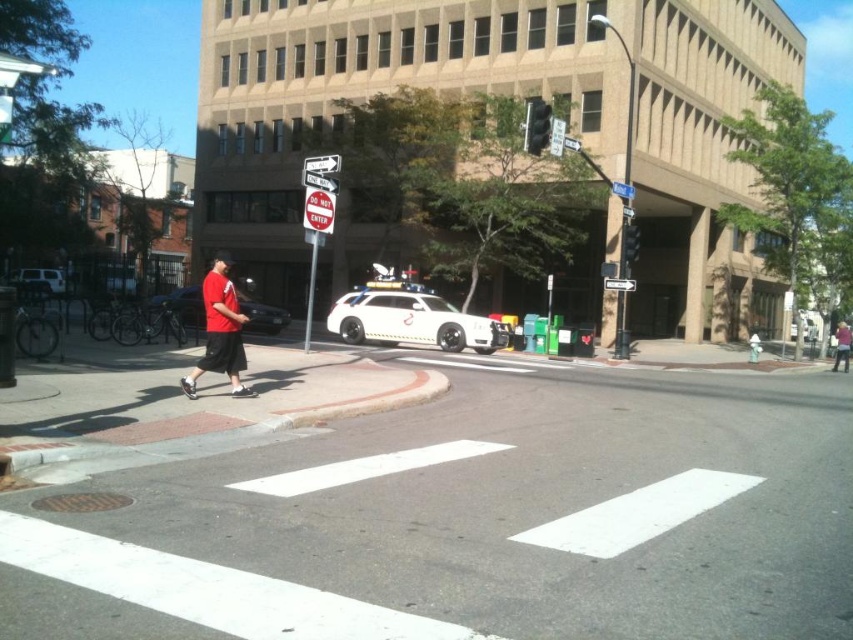
Question: Which point appears farthest from the camera in this image?

Choices:
 (A) (634, 257)
 (B) (276, 320)

Answer: (B)

Question: Is metallic traffic light at upper center positioned at the back of pink fabric shirt at center?

Choices:
 (A) no
 (B) yes

Answer: (A)

Question: Is white glossy suv at center to the left of white glossy car at left from the viewer's perspective?

Choices:
 (A) yes
 (B) no

Answer: (B)

Question: In this image, where is pink fabric shirt at center located relative to metallic traffic light at upper right?

Choices:
 (A) left
 (B) right

Answer: (B)

Question: Based on their relative distances, which object is farther from the red matte shirt at left?

Choices:
 (A) metallic traffic light at upper right
 (B) matte red shirt at center

Answer: (A)

Question: Which is farther from the metallic traffic light at upper center?

Choices:
 (A) pink fabric shirt at center
 (B) white glossy suv at center
 (C) red matte shirt at left
 (D) metallic traffic light at upper right

Answer: (A)